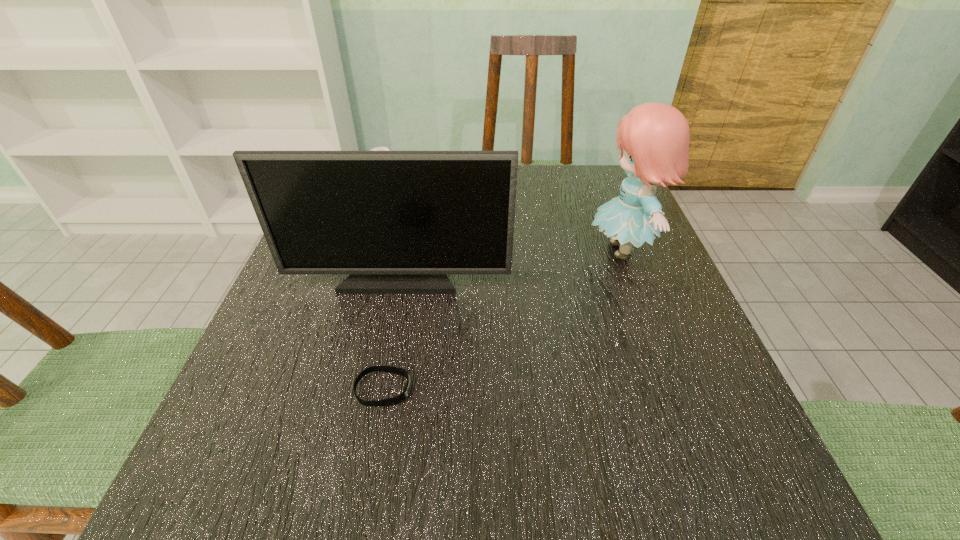
The width and height of the screenshot is (960, 540). I want to click on blank space located on the left of the beer can, so click(x=353, y=195).

The height and width of the screenshot is (540, 960). In order to click on vacant space located on the display of the wristband in this screenshot , I will do `click(553, 389)`.

Locate an element on the screen. The height and width of the screenshot is (540, 960). doll located in the far edge section of the desktop is located at coordinates (653, 138).

Locate an element on the screen. Image resolution: width=960 pixels, height=540 pixels. beer can that is positioned at the far edge is located at coordinates (376, 148).

The height and width of the screenshot is (540, 960). I want to click on monitor that is at the left edge, so click(x=397, y=221).

In order to click on beer can positioned at the left edge in this screenshot , I will do `click(376, 148)`.

You are a GUI agent. You are given a task and a screenshot of the screen. Output one action in this format:
    pyautogui.click(x=<x>, y=<y>)
    Task: Click on the object that is positioned at the right edge
    This screenshot has height=540, width=960.
    Given the screenshot: What is the action you would take?
    pyautogui.click(x=653, y=138)

Where is `object located at the far left corner`? The image size is (960, 540). object located at the far left corner is located at coordinates (376, 148).

The width and height of the screenshot is (960, 540). Identify the location of object present at the far right corner. (653, 138).

Locate an element on the screen. The width and height of the screenshot is (960, 540). vacant space at the near edge of the desktop is located at coordinates (626, 501).